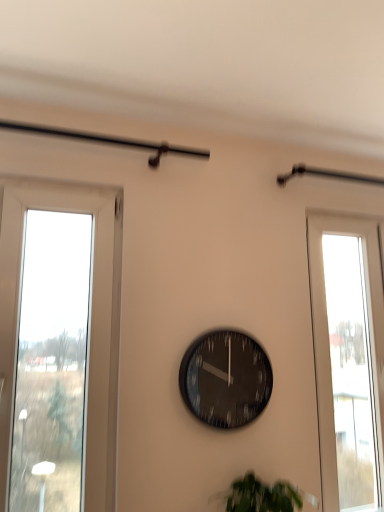
In order to face black glass clock at center, should I rotate leftwards or rightwards?

To align with it, rotate right about 4.463°.

The image size is (384, 512). What do you see at coordinates (260, 496) in the screenshot?
I see `green leafy plant at lower center` at bounding box center [260, 496].

I want to click on black glass clock at center, so click(225, 379).

Considering the points (244, 511) and (332, 432), which point is behind, point (244, 511) or point (332, 432)?

Positioned behind is point (332, 432).

Could you tell me if green leafy plant at lower center is turned towards transparent glass window at right?

No, green leafy plant at lower center is not oriented towards transparent glass window at right.

From the image's perspective, is green leafy plant at lower center beneath transparent glass window at right?

Yes, from the image's perspective, green leafy plant at lower center is below transparent glass window at right.

Is green leafy plant at lower center not close to transparent glass window at right?

No, there isn't a large distance between green leafy plant at lower center and transparent glass window at right.

From a real-world perspective, is black glass clock at center physically above transparent glass window at right?

No, from a real-world perspective, black glass clock at center is not above transparent glass window at right.

Considering the positions of objects black glass clock at center and transparent glass window at right in the image provided, who is more to the left, black glass clock at center or transparent glass window at right?

black glass clock at center.

In the scene shown: Would you say black glass clock at center contains transparent glass window at right?

Definitely not — transparent glass window at right is not inside black glass clock at center.

Are black glass clock at center and transparent glass window at right far apart?

black glass clock at center is near transparent glass window at right, not far away.

You are a GUI agent. You are given a task and a screenshot of the screen. Output one action in this format:
    pyautogui.click(x=<x>, y=<y>)
    Task: Click on the window above the black glass clock at center (from the image's perspective)
    Image resolution: width=384 pixels, height=512 pixels.
    Given the screenshot: What is the action you would take?
    pyautogui.click(x=348, y=359)

Which object is thinner, transparent glass window at right or black glass clock at center?

Thinner between the two is black glass clock at center.

Is transparent glass window at right next to black glass clock at center?

No, transparent glass window at right is not in contact with black glass clock at center.

Can you confirm if transparent glass window at right is shorter than black glass clock at center?

No, transparent glass window at right is not shorter than black glass clock at center.

How distant is black glass clock at center from green leafy plant at lower center?

black glass clock at center and green leafy plant at lower center are 13.87 inches apart.

Which is in front, black glass clock at center or green leafy plant at lower center?

green leafy plant at lower center is closer to the camera.

From the image's perspective, is black glass clock at center under green leafy plant at lower center?

Actually, black glass clock at center appears above green leafy plant at lower center in the image.

In the image, is black glass clock at center on the left side or the right side of green leafy plant at lower center?

Clearly, black glass clock at center is on the left of green leafy plant at lower center in the image.

Considering the sizes of objects green leafy plant at lower center and black glass clock at center in the image provided, who is shorter, green leafy plant at lower center or black glass clock at center?

With less height is green leafy plant at lower center.

Does green leafy plant at lower center have a larger size compared to black glass clock at center?

Indeed, green leafy plant at lower center has a larger size compared to black glass clock at center.

Can you see green leafy plant at lower center touching black glass clock at center?

No, green leafy plant at lower center is not with black glass clock at center.

Is green leafy plant at lower center oriented towards black glass clock at center?

No, green leafy plant at lower center does not turn towards black glass clock at center.

Does transparent glass window at right have a lesser height compared to green leafy plant at lower center?

In fact, transparent glass window at right may be taller than green leafy plant at lower center.

Could you tell me if transparent glass window at right is turned towards green leafy plant at lower center?

No, transparent glass window at right is not oriented towards green leafy plant at lower center.

In the image, is transparent glass window at right positioned in front of or behind green leafy plant at lower center?

transparent glass window at right is positioned farther from the viewer than green leafy plant at lower center.

In the image, is transparent glass window at right on the left side or the right side of green leafy plant at lower center?

From the image, it's evident that transparent glass window at right is to the right of green leafy plant at lower center.

Locate an element on the screen. Image resolution: width=384 pixels, height=512 pixels. window located above the green leafy plant at lower center (from the image's perspective) is located at coordinates (348, 359).

Image resolution: width=384 pixels, height=512 pixels. Find the location of `window above the black glass clock at center (from a real-world perspective)`. window above the black glass clock at center (from a real-world perspective) is located at coordinates click(x=348, y=359).

When comparing their distances from green leafy plant at lower center, does transparent glass window at right or black glass clock at center seem further?

transparent glass window at right.

When comparing their distances from transparent glass window at right, does green leafy plant at lower center or black glass clock at center seem closer?

black glass clock at center is positioned closer to the anchor transparent glass window at right.

Based on their spatial positions, is black glass clock at center or transparent glass window at right closer to green leafy plant at lower center?

black glass clock at center.

Considering their positions, is black glass clock at center positioned further to transparent glass window at right than green leafy plant at lower center?

green leafy plant at lower center is further to transparent glass window at right.

From the image, which object appears to be nearer to black glass clock at center, green leafy plant at lower center or transparent glass window at right?

green leafy plant at lower center is closer to black glass clock at center.

From the image, which object appears to be nearer to black glass clock at center, transparent glass window at right or green leafy plant at lower center?

green leafy plant at lower center is closer to black glass clock at center.

Identify the location of plant between black glass clock at center and transparent glass window at right in the horizontal direction. This screenshot has width=384, height=512. coord(260,496).